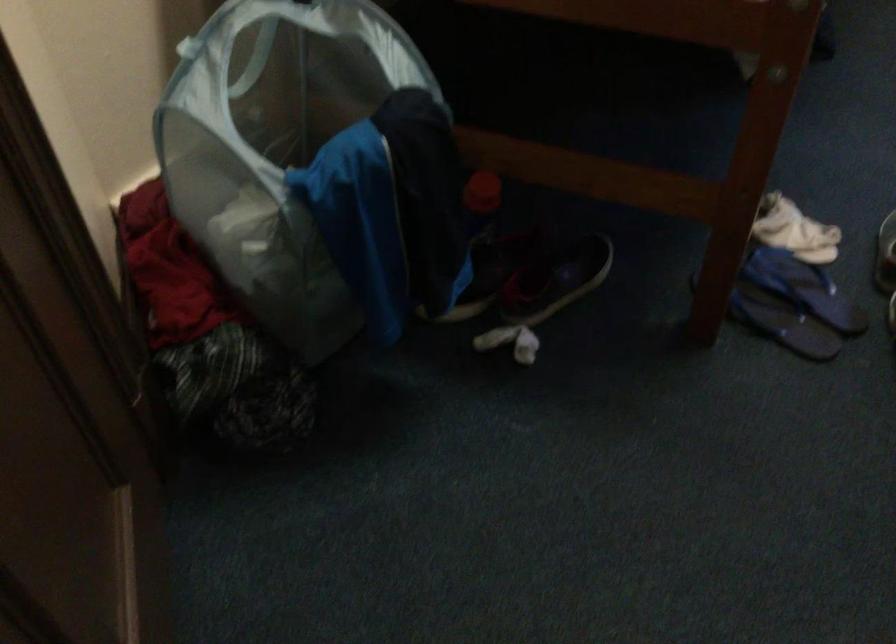
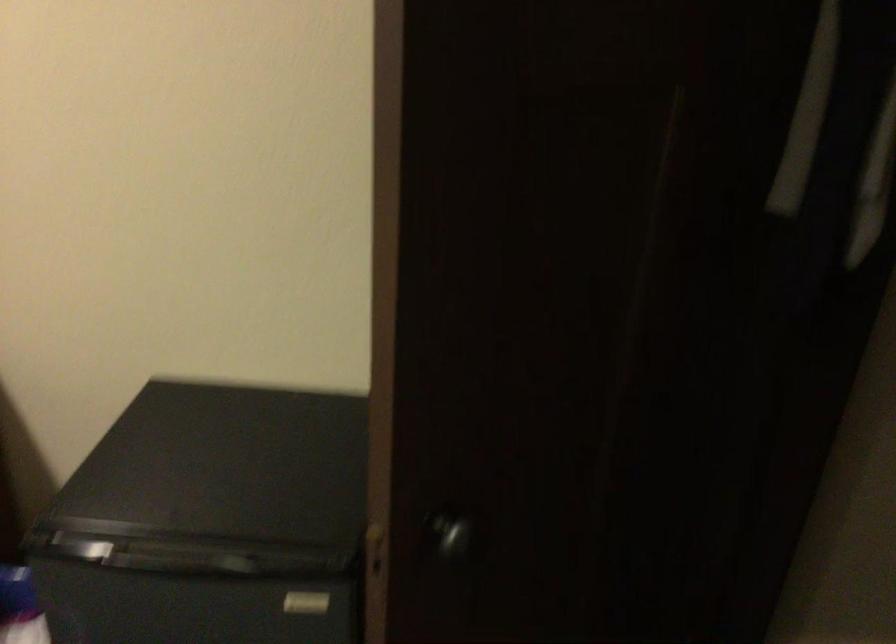
How did the camera likely rotate?

The rotation direction of the camera is right-down.